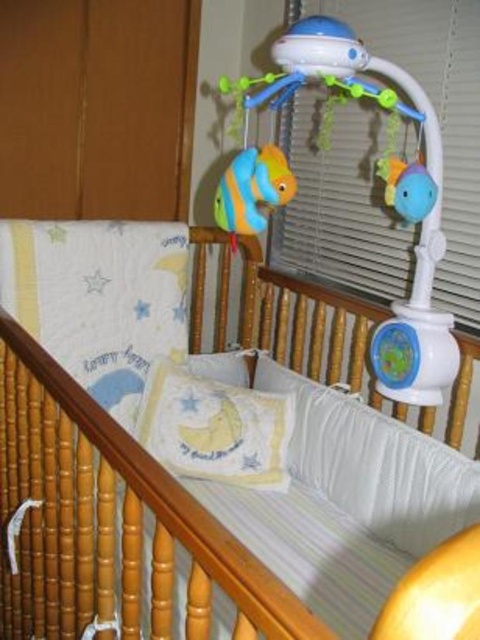
Question: From the image, what is the correct spatial relationship of blue plastic mobile at upper center in relation to multicolored plush fish at upper center?

Choices:
 (A) above
 (B) below

Answer: (A)

Question: Which point is farther from the camera taking this photo?

Choices:
 (A) (309, 262)
 (B) (411, 212)
 (C) (228, 388)
 (D) (187, 627)

Answer: (A)

Question: Can you confirm if white striped mattress at center is bigger than blue plastic mobile at upper center?

Choices:
 (A) no
 (B) yes

Answer: (B)

Question: Which point appears closest to the camera in this image?

Choices:
 (A) (160, 380)
 (B) (372, 420)

Answer: (B)

Question: Which point is farther to the camera?

Choices:
 (A) (418, 163)
 (B) (335, 157)
 (C) (328, 504)

Answer: (B)

Question: Is the position of white striped mattress at center less distant than that of multicolored plush fish at upper center?

Choices:
 (A) yes
 (B) no

Answer: (A)